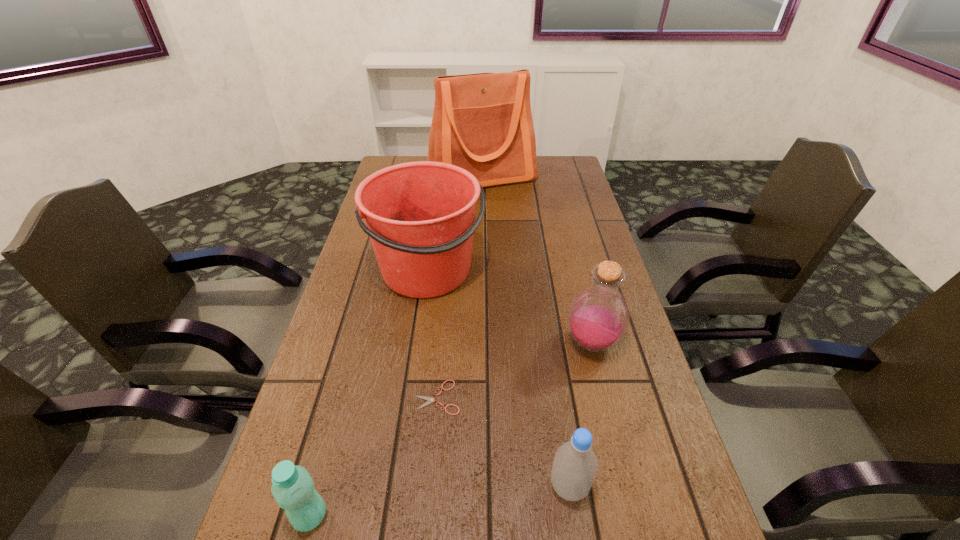
The height and width of the screenshot is (540, 960). What are the coordinates of `vacant area that lies between the rightmost bottle and the fourth farthest object` in the screenshot? It's located at (515, 370).

Where is `vacant space that's between the leftmost bottle and the fourth nearest object`? This screenshot has width=960, height=540. vacant space that's between the leftmost bottle and the fourth nearest object is located at coordinates (451, 430).

Find the location of `vacant area that lies between the shortest object and the second bottle from left to right`. vacant area that lies between the shortest object and the second bottle from left to right is located at coordinates (503, 442).

Point out which object is positioned as the nearest to the farthest object. Please provide its 2D coordinates. Your answer should be formatted as a tuple, i.e. [(x, y)], where the tuple contains the x and y coordinates of a point satisfying the conditions above.

[(420, 216)]

Where is `object that is the fourth closest to the leftmost bottle`? This screenshot has height=540, width=960. object that is the fourth closest to the leftmost bottle is located at coordinates (598, 317).

The image size is (960, 540). Find the location of `bottle object that ranks as the second closest to the farthest bottle`. bottle object that ranks as the second closest to the farthest bottle is located at coordinates (293, 489).

Select which bottle appears as the closest to the leftmost bottle. Please provide its 2D coordinates. Your answer should be formatted as a tuple, i.e. [(x, y)], where the tuple contains the x and y coordinates of a point satisfying the conditions above.

[(575, 465)]

At what (x,y) coordinates should I click in order to perform the action: click on blank space that satisfies the following two spatial constraints: 1. on the back side of the tallest object; 2. on the left side of the shears. Please return your answer as a coordinate pair (x, y). The width and height of the screenshot is (960, 540). Looking at the image, I should click on (456, 177).

In order to click on free location that satisfies the following two spatial constraints: 1. on the back side of the leftmost bottle; 2. on the left side of the farthest object in this screenshot , I will do `click(402, 177)`.

Image resolution: width=960 pixels, height=540 pixels. In order to click on vacant space that satisfies the following two spatial constraints: 1. on the front side of the bucket; 2. on the right side of the shortest object in this screenshot , I will do `click(411, 397)`.